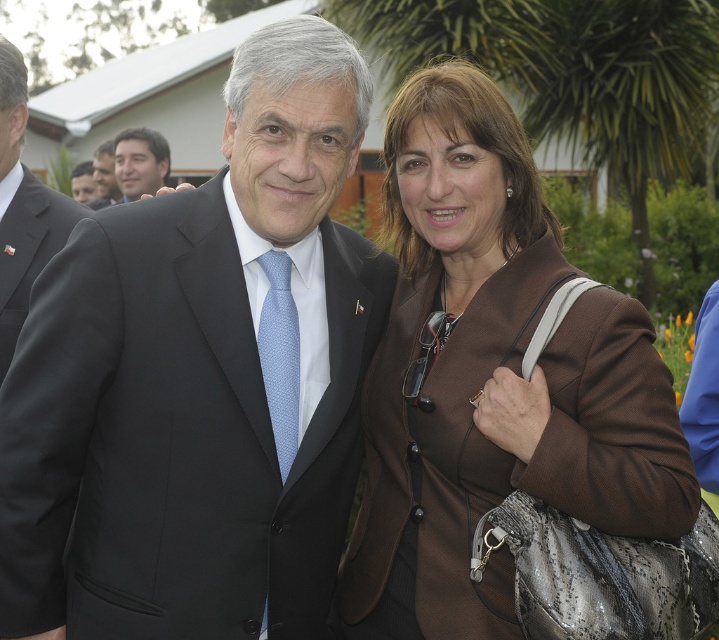
Based on the photo, you are a photographer at the event and want to ensure both the black smooth suit at center and the light blue textured tie at center are clearly visible in your photo. Which object should you focus on first to ensure proper focus, considering their sizes?

The black smooth suit at center has a larger size compared to the light blue textured tie at center, so focusing on the larger black smooth suit at center first will ensure proper focus as it covers more area and is easier to detect.

You are standing at the origin point in the image. Which direction should you move to reach the black smooth suit at center?

The black smooth suit at center is located at coordinates 0.681 on the x axis and 0.243 on the y axis. Since you are at the origin, you should move right along the x axis and slightly up along the y axis to reach it.